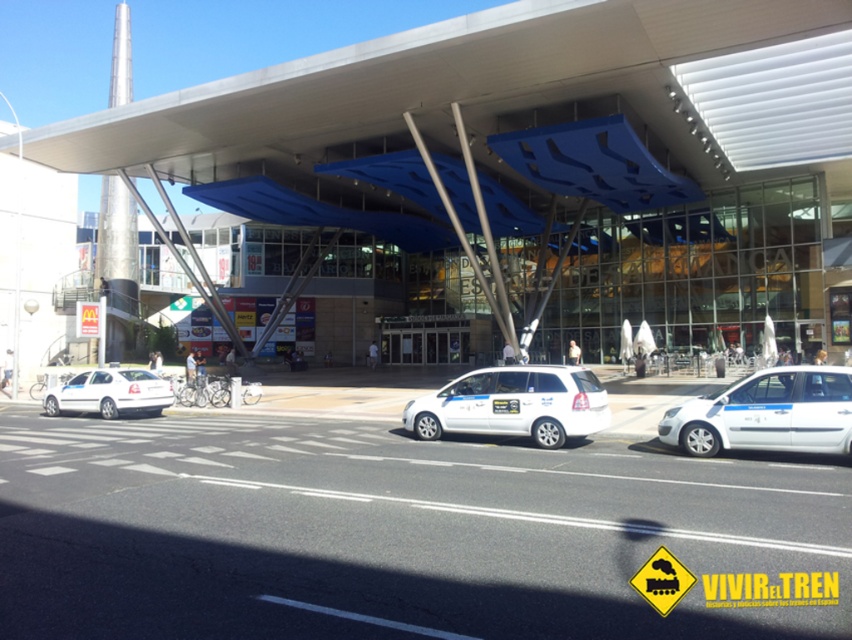
Question: Among these points, which one is farthest from the camera?

Choices:
 (A) (712, 403)
 (B) (486, 426)

Answer: (B)

Question: Which object is positioned farthest from the white matte van at center?

Choices:
 (A) white matte van at left
 (B) white matte van at right

Answer: (A)

Question: Can you confirm if transparent glass building at center is positioned to the right of white matte van at left?

Choices:
 (A) no
 (B) yes

Answer: (B)

Question: Does transparent glass building at center appear on the right side of white matte van at right?

Choices:
 (A) no
 (B) yes

Answer: (A)

Question: From the image, what is the correct spatial relationship of transparent glass building at center in relation to white matte van at center?

Choices:
 (A) above
 (B) below

Answer: (A)

Question: Which of the following is the closest to the observer?

Choices:
 (A) transparent glass building at center
 (B) white matte van at center
 (C) white matte van at left

Answer: (B)